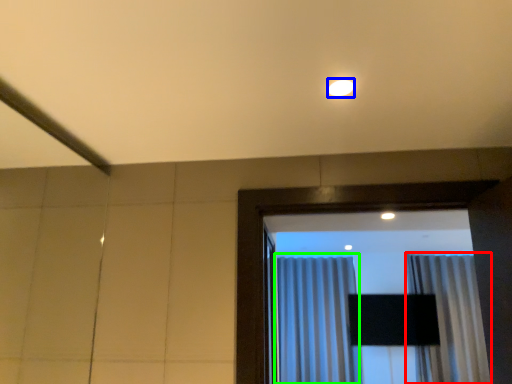
Question: Based on their relative distances, which object is nearer to curtain (highlighted by a red box)? Choose from lighting (highlighted by a blue box) and curtain (highlighted by a green box).

Choices:
 (A) lighting
 (B) curtain

Answer: (B)